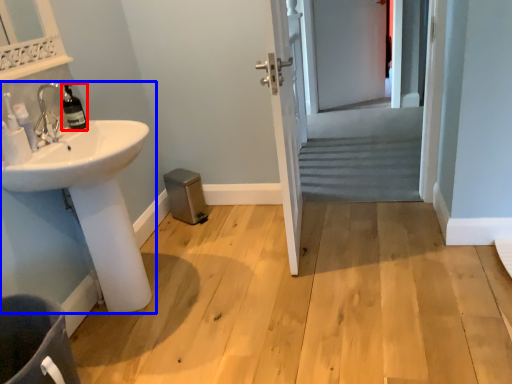
Question: Which point is further to the camera, bottle (highlighted by a red box) or sink (highlighted by a blue box)?

Choices:
 (A) bottle
 (B) sink

Answer: (A)